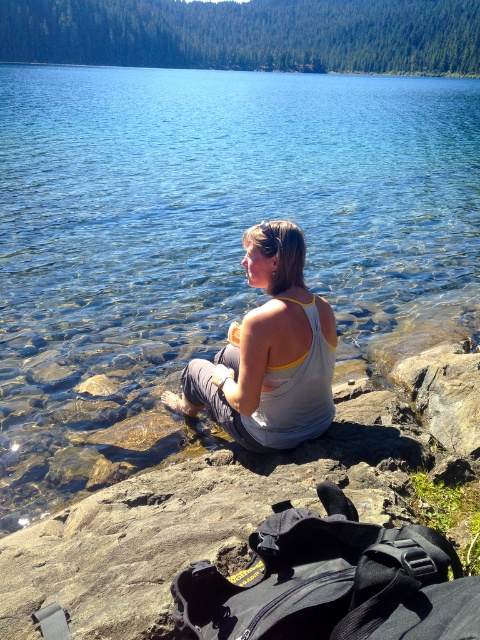
You are standing at the point with coordinates point (266, 228) and want to walk towards the point with coordinates point (359, 138). Which direction should you face to move towards your destination?

You should face towards the direction of point (359, 138) from point (266, 228). Since point (359, 138) is behind point (266, 228), you need to turn around and walk in the opposite direction to reach your destination.

You are a photographer trying to capture the woman in the scene. You notice the white cotton tank top at center and the gray rock at right. Which object is covering the other in the image?

The white cotton tank top at center is positioned over the gray rock at right, meaning it is covering the rock in the image.